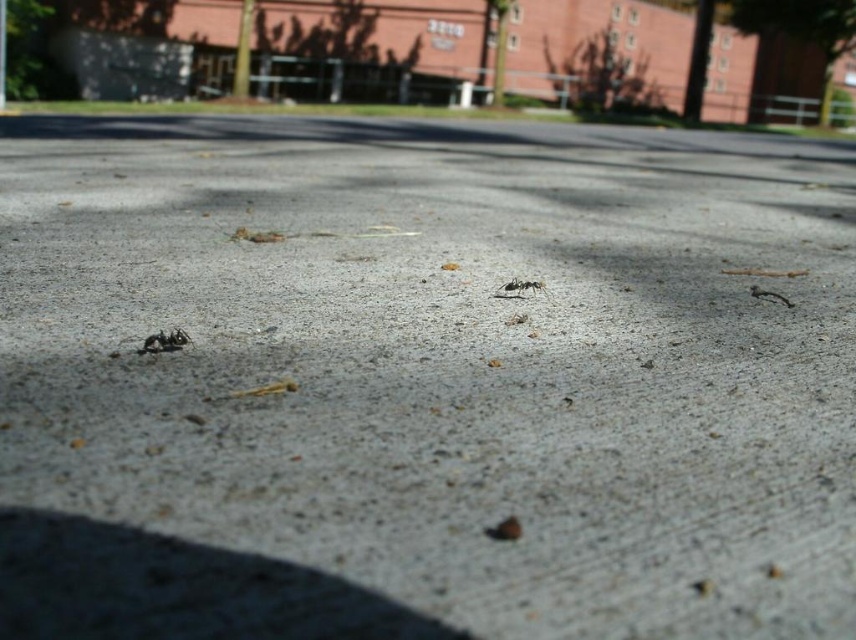
You are a tiny robot measuring 0.5 inches in width. You are positioned between the black matte ant at lower left and the black matte ant at center on the paved surface. Can you safely navigate between them without touching either ant?

The distance between the black matte ant at lower left and the black matte ant at center is 35.31 inches. Since the robot is only 0.5 inches wide, there is ample space for it to navigate between them safely without touching either ant.

You are a photographer trying to capture the black matte ant at center in a close up shot. The camera you are using has a fixed focus point at coordinate 0.5, 0.5. Will the ant be in focus?

The black matte ant at center is located at point (521, 285), which is close to but not exactly at the camera focus point of (428, 320). Depending on the depth of field, it might be slightly out of focus. To ensure clarity, adjust the focus point to match the ant.

You are a child observing two ants on the pavement. You notice the black matte ant at lower left and the black matte ant at right. Which ant do you think has a larger body size?

The black matte ant at lower left might be wider than the black matte ant at right, suggesting it could have a larger body size.